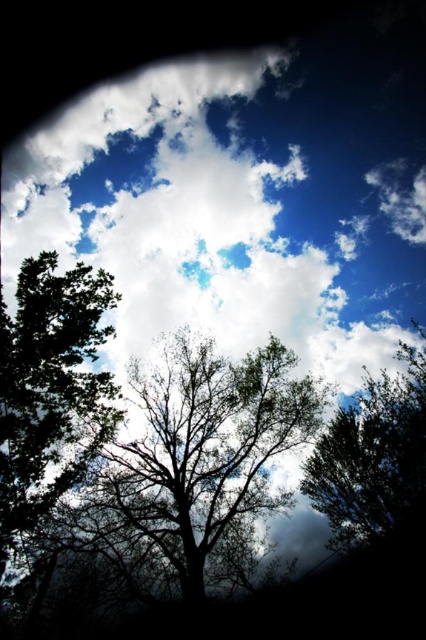
You are an artist trying to paint the scene. You notice two trees at the center of the image. Which tree is closer to the ground, the silhouette leafy tree at center or the green leafy tree at center?

The silhouette leafy tree at center is located below the green leafy tree at center, so the silhouette leafy tree at center is closer to the ground.

You are standing in the scene looking at the sky. There is a point at coordinates (192, 458). What object is located at that point?

The point at coordinates (192, 458) indicates a silhouette leafy tree at center.

You are an artist trying to paint the scene. You notice two trees at the center of the image. Which one is wider, the silhouette leafy tree at center or the green leafy tree at center?

The silhouette leafy tree at center might be wider than the green leafy tree at center according to the description.